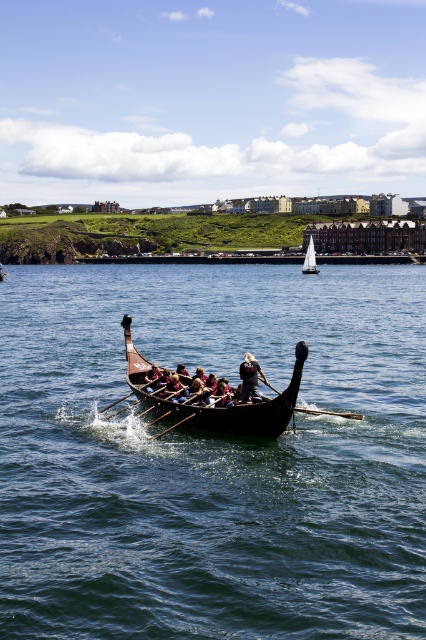
Question: Estimate the real-world distances between objects in this image. Which object is farther from the white sailboat at upper center?

Choices:
 (A) dark blue water at center
 (B) dark brown leather helmet at center
 (C) wooden at center

Answer: (C)

Question: Is dark brown leather helmet at center in front of wooden at center?

Choices:
 (A) no
 (B) yes

Answer: (A)

Question: Considering the relative positions of dark blue water at center and dark brown leather helmet at center in the image provided, where is dark blue water at center located with respect to dark brown leather helmet at center?

Choices:
 (A) above
 (B) below

Answer: (A)

Question: Can you confirm if dark blue water at center is smaller than white sailboat at upper center?

Choices:
 (A) yes
 (B) no

Answer: (B)

Question: Which point is farther to the camera?

Choices:
 (A) wooden at center
 (B) wooden dark brown canoe at center
 (C) white sailboat at upper center

Answer: (C)

Question: Which is nearer to the white sailboat at upper center?

Choices:
 (A) dark blue water at center
 (B) wooden dark brown canoe at center
 (C) wooden at center

Answer: (A)